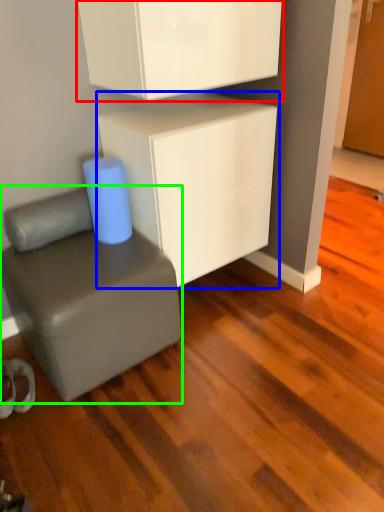
Question: Considering the real-world distances, which object is farthest from cabinetry (highlighted by a red box)? cabinetry (highlighted by a blue box) or furniture (highlighted by a green box)?

Choices:
 (A) cabinetry
 (B) furniture

Answer: (B)